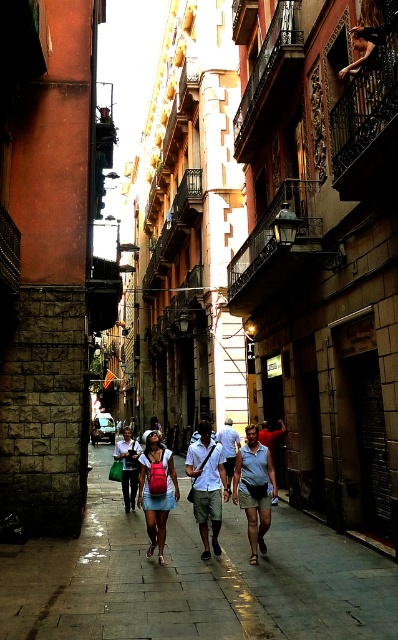
Is denim skirt at center bigger than matte pink backpack at center?

Incorrect, denim skirt at center is not larger than matte pink backpack at center.

Does denim skirt at center appear on the right side of matte pink backpack at center?

Correct, you'll find denim skirt at center to the right of matte pink backpack at center.

Who is more forward, (x=148, y=515) or (x=117, y=460)?

Point (x=148, y=515)

Where is `denim skirt at center`? denim skirt at center is located at coordinates (156, 492).

Who is positioned more to the left, smooth concrete pavement at center or white cotton shirt at center?

From the viewer's perspective, smooth concrete pavement at center appears more on the left side.

Who is higher up, smooth concrete pavement at center or white cotton shirt at center?

white cotton shirt at center

Image resolution: width=398 pixels, height=640 pixels. I want to click on smooth concrete pavement at center, so click(193, 579).

Who is more forward, (277, 560) or (239, 436)?

Point (277, 560) is more forward.

Who is taller, smooth concrete pavement at center or light blue denim shorts at center?

light blue denim shorts at center is taller.

Does point (200, 593) come closer to viewer compared to point (228, 486)?

Yes, it is.

Identify the location of smooth concrete pavement at center. The height and width of the screenshot is (640, 398). (193, 579).